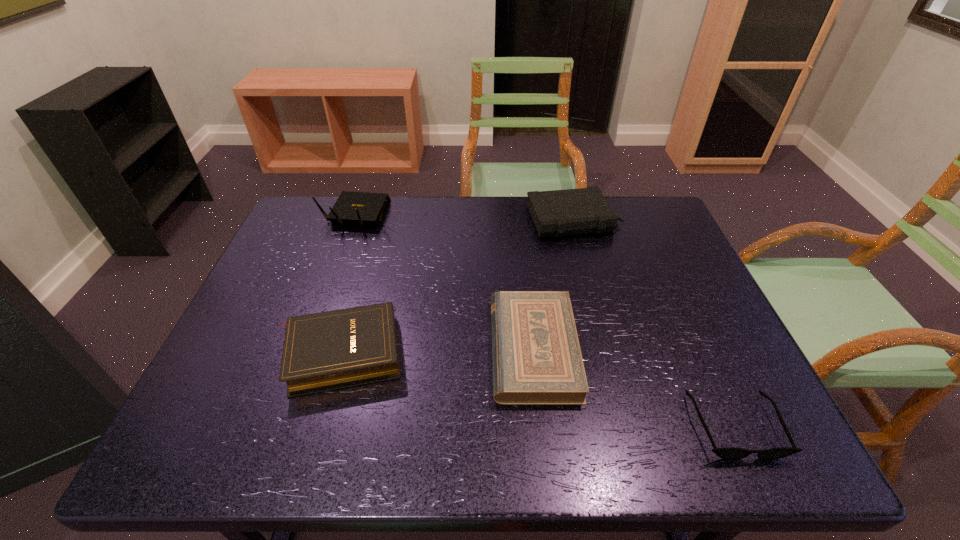
At what (x,y) coordinates should I click in order to perform the action: click on vacant area between the shortest Bible and the farthest Bible. Please return your answer as a coordinate pair (x, y). Looking at the image, I should click on (554, 285).

This screenshot has width=960, height=540. Identify the location of vacant space in between the leftmost Bible and the farthest Bible. (457, 286).

The height and width of the screenshot is (540, 960). I want to click on vacant region between the farthest Bible and the leftmost Bible, so click(457, 286).

You are a GUI agent. You are given a task and a screenshot of the screen. Output one action in this format:
    pyautogui.click(x=<x>, y=<y>)
    Task: Click on the vacant area between the farthest Bible and the shortest Bible
    
    Given the screenshot: What is the action you would take?
    pyautogui.click(x=554, y=285)

Where is `vacant space in between the tallest object and the leftmost Bible`? vacant space in between the tallest object and the leftmost Bible is located at coordinates (348, 284).

In order to click on object that stands as the fourth closest to the sunglasses in this screenshot , I will do `click(358, 208)`.

In order to click on object that can be found as the second closest to the tallest object in this screenshot , I will do `click(536, 355)`.

Locate which Bible ranks third in proximity to the sunglasses. Please provide its 2D coordinates. Your answer should be formatted as a tuple, i.e. [(x, y)], where the tuple contains the x and y coordinates of a point satisfying the conditions above.

[(329, 350)]

You are a GUI agent. You are given a task and a screenshot of the screen. Output one action in this format:
    pyautogui.click(x=<x>, y=<y>)
    Task: Click on the Bible that stands as the closest to the router
    Image resolution: width=960 pixels, height=540 pixels.
    Given the screenshot: What is the action you would take?
    pyautogui.click(x=329, y=350)

The width and height of the screenshot is (960, 540). In order to click on blank area in the image that satisfies the following two spatial constraints: 1. on the spine side of the shortest Bible; 2. on the front side of the leftmost Bible in this screenshot , I will do `click(534, 353)`.